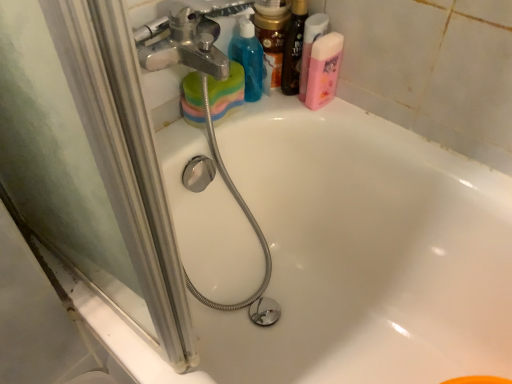
In order to click on free space to the left of pink matte bottle at upper right, which appears as the second cleaning product when viewed from the left in this screenshot , I will do `click(269, 110)`.